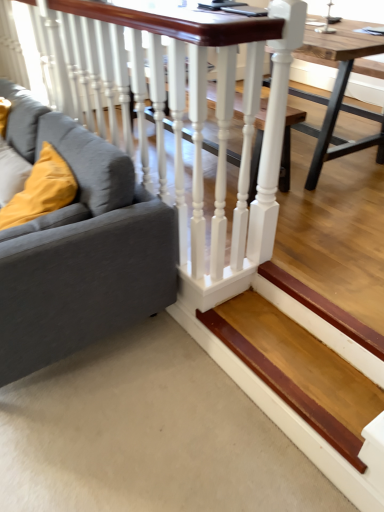
The height and width of the screenshot is (512, 384). What do you see at coordinates (286, 389) in the screenshot? I see `wooden stair at lower right` at bounding box center [286, 389].

Measure the distance between velvet yellow pillow at left and camera.

1.57 meters.

In order to click on wooden stair at lower right in this screenshot , I will do `click(286, 389)`.

Is velvet yellow pillow at left situated inside white glossy rail at upper left or outside?

velvet yellow pillow at left is spatially situated outside white glossy rail at upper left.

From a real-world perspective, is velvet yellow pillow at left on top of white glossy rail at upper left?

No.

Is velvet yellow pillow at left thinner than white glossy rail at upper left?

Incorrect, the width of velvet yellow pillow at left is not less than that of white glossy rail at upper left.

How much distance is there between velvet yellow pillow at left and white glossy rail at upper left?

A distance of 54.45 centimeters exists between velvet yellow pillow at left and white glossy rail at upper left.

Considering the sizes of white glossy rail at upper left and wooden stair at lower right in the image, is white glossy rail at upper left wider or thinner than wooden stair at lower right?

white glossy rail at upper left is thinner than wooden stair at lower right.

How different are the orientations of white glossy rail at upper left and wooden stair at lower right in degrees?

The angular difference between white glossy rail at upper left and wooden stair at lower right is 179 degrees.

Are white glossy rail at upper left and wooden stair at lower right beside each other?

No, white glossy rail at upper left is not making contact with wooden stair at lower right.

Which of these two, white glossy rail at upper left or wooden stair at lower right, is bigger?

Bigger between the two is white glossy rail at upper left.

Who is more distant, wooden stair at lower right or white glossy rail at upper left?

wooden stair at lower right is further away from the camera.

This screenshot has height=512, width=384. I want to click on stairs below the white glossy rail at upper left (from a real-world perspective), so click(286, 389).

How different are the orientations of wooden stair at lower right and white glossy rail at upper left in degrees?

179 degrees.

Between wooden stair at lower right and white glossy rail at upper left, which one has smaller size?

Smaller between the two is wooden stair at lower right.

Is wooden stair at lower right not within wooden table at center?

Absolutely, wooden stair at lower right is external to wooden table at center.

Could you tell me if wooden stair at lower right is turned towards wooden table at center?

No.

From the image's perspective, which is above, wooden stair at lower right or wooden table at center?

wooden table at center appears higher in the image.

Considering the relative sizes of wooden stair at lower right and wooden table at center in the image provided, is wooden stair at lower right shorter than wooden table at center?

Yes, wooden stair at lower right is shorter than wooden table at center.

Does point (192, 106) appear closer or farther from the camera than point (285, 149)?

Point (192, 106) is positioned closer to the camera compared to point (285, 149).

From a real-world perspective, which is physically above, white glossy rail at upper left or wooden table at center?

white glossy rail at upper left, from a real-world perspective.

Is white glossy rail at upper left directly adjacent to wooden table at center?

There is a gap between white glossy rail at upper left and wooden table at center.

From a real-world perspective, which is physically above, velvet yellow pillow at left or wooden stair at lower right?

velvet yellow pillow at left.

Which of these two, velvet yellow pillow at left or wooden stair at lower right, is wider?

wooden stair at lower right.

From the image's perspective, which is below, velvet yellow pillow at left or wooden stair at lower right?

wooden stair at lower right appears lower in the image.

Consider the image. Is velvet yellow pillow at left positioned before wooden stair at lower right?

That is False.

From a real-world perspective, which is physically below, velvet yellow pillow at left or gray fabric couch at left?

gray fabric couch at left, from a real-world perspective.

Looking at this image, is velvet yellow pillow at left thinner than gray fabric couch at left?

Yes, velvet yellow pillow at left is thinner than gray fabric couch at left.

Who is more distant, velvet yellow pillow at left or gray fabric couch at left?

velvet yellow pillow at left.

Is velvet yellow pillow at left oriented away from gray fabric couch at left?

Yes, velvet yellow pillow at left's orientation is away from gray fabric couch at left.

Where is `rail above the velvet yellow pillow at left (from the image's perspective)`? The image size is (384, 512). rail above the velvet yellow pillow at left (from the image's perspective) is located at coordinates [x=190, y=117].

Identify the location of rail located in front of the wooden stair at lower right. The height and width of the screenshot is (512, 384). (190, 117).

Based on their spatial positions, is velvet yellow pillow at left or wooden table at center further from wooden stair at lower right?

wooden table at center lies further to wooden stair at lower right than the other object.

Estimate the real-world distances between objects in this image. Which object is further from white glossy rail at upper left, velvet yellow pillow at left or wooden stair at lower right?

wooden stair at lower right.

Based on their spatial positions, is wooden stair at lower right or velvet yellow pillow at left closer to gray fabric couch at left?

velvet yellow pillow at left is positioned closer to the anchor gray fabric couch at left.

Looking at the image, which one is located closer to gray fabric couch at left, velvet yellow pillow at left or wooden stair at lower right?

velvet yellow pillow at left is positioned closer to the anchor gray fabric couch at left.

From the image, which object appears to be nearer to white glossy rail at upper left, velvet yellow pillow at left or gray fabric couch at left?

gray fabric couch at left is positioned closer to the anchor white glossy rail at upper left.

Based on their spatial positions, is wooden stair at lower right or wooden table at center further from gray fabric couch at left?

Based on the image, wooden table at center appears to be further to gray fabric couch at left.

Estimate the real-world distances between objects in this image. Which object is closer to velvet yellow pillow at left, white glossy rail at upper left or gray fabric couch at left?

gray fabric couch at left.

Considering their positions, is white glossy rail at upper left positioned closer to gray fabric couch at left than wooden stair at lower right?

white glossy rail at upper left is positioned closer to the anchor gray fabric couch at left.

Find the location of a particular element. The width and height of the screenshot is (384, 512). rail between gray fabric couch at left and wooden stair at lower right from left to right is located at coordinates (190, 117).

Image resolution: width=384 pixels, height=512 pixels. What are the coordinates of `rail between wooden table at center and wooden stair at lower right from top to bottom` in the screenshot? It's located at (190, 117).

The height and width of the screenshot is (512, 384). I want to click on stairs between velvet yellow pillow at left and wooden table at center from left to right, so click(286, 389).

The image size is (384, 512). Identify the location of rail between velvet yellow pillow at left and wooden stair at lower right from left to right. (190, 117).